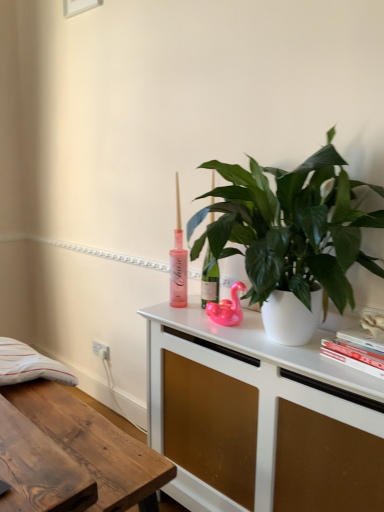
The width and height of the screenshot is (384, 512). I want to click on free space above white matte cabinet at center (from a real-world perspective), so click(284, 345).